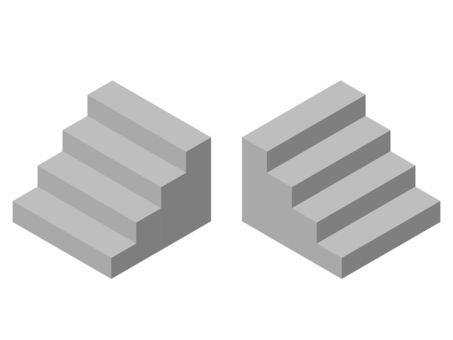
The width and height of the screenshot is (453, 340). In order to click on stairs in this screenshot , I will do `click(53, 238)`, `click(93, 201)`, `click(125, 172)`, `click(157, 141)`, `click(303, 141)`, `click(334, 172)`, `click(366, 201)`, `click(380, 241)`.